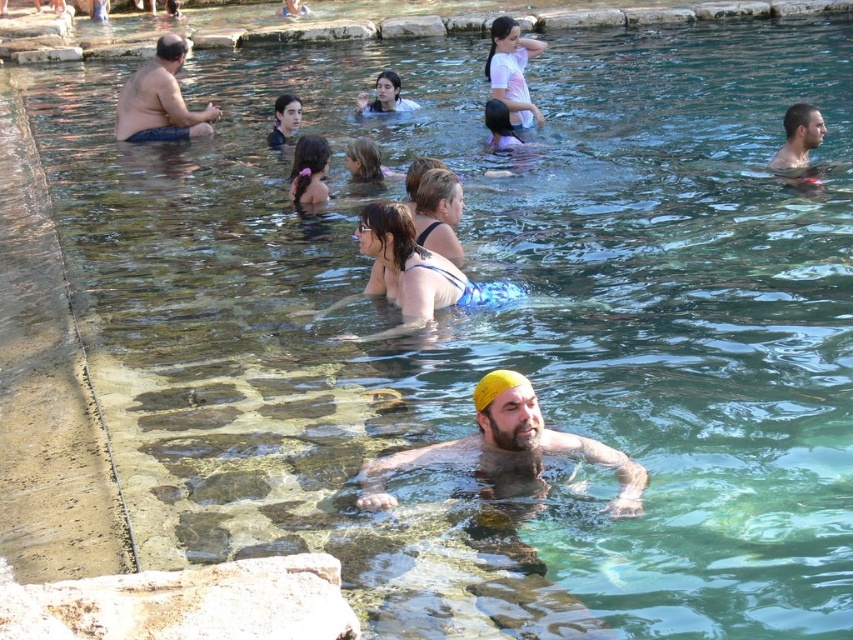
Question: Which point is closer to the camera?

Choices:
 (A) smooth skin head at upper right
 (B) matte skin man at left

Answer: (A)

Question: Which object appears closest to the camera in this image?

Choices:
 (A) dark brown hair at center
 (B) matte black swimsuit at upper center
 (C) smooth skin head at upper right

Answer: (A)

Question: Is dark brown hair at center above yellow fabric swim cap at center?

Choices:
 (A) yes
 (B) no

Answer: (A)

Question: Considering the relative positions of smooth skin head at upper right and smooth skin face at upper center in the image provided, where is smooth skin head at upper right located with respect to smooth skin face at upper center?

Choices:
 (A) above
 (B) below

Answer: (B)

Question: Can you confirm if matte skin man at left is positioned to the right of smooth skin head at upper right?

Choices:
 (A) yes
 (B) no

Answer: (B)

Question: Which object is closer to the camera taking this photo?

Choices:
 (A) smooth skin face at upper center
 (B) dark brown hair at center
 (C) white matte shirt at upper center
 (D) yellow fabric swim cap at center

Answer: (D)